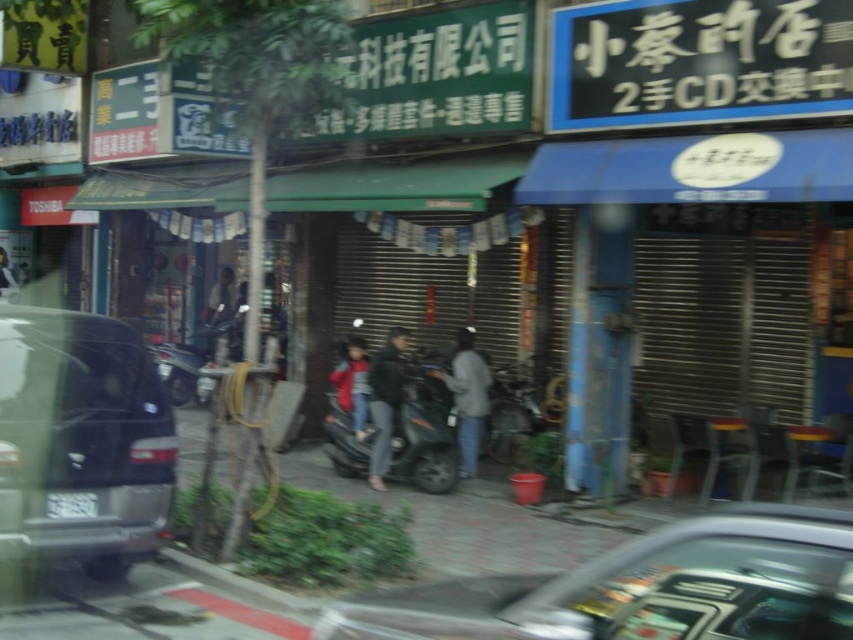
Question: Estimate the real-world distances between objects in this image. Which object is closer to the black plastic license plate at center?

Choices:
 (A) red velvet coat at center
 (B) metallic silver car at center

Answer: (B)

Question: Can you confirm if dark gray jacket at center is positioned below red velvet coat at center?

Choices:
 (A) yes
 (B) no

Answer: (A)

Question: Considering the real-world distances, which object is farthest from the black plastic license plate at center?

Choices:
 (A) metallic silver car at center
 (B) red velvet coat at center
 (C) dark gray jacket at center
 (D) matte black car at left

Answer: (B)

Question: Does gray fabric jacket at center have a larger size compared to red velvet coat at center?

Choices:
 (A) yes
 (B) no

Answer: (A)

Question: Which object is closer to the camera taking this photo?

Choices:
 (A) gray fabric jacket at center
 (B) matte black car at left
 (C) dark gray jacket at center
 (D) metallic silver car at center

Answer: (D)

Question: Can you confirm if metallic silver car at center is positioned below red velvet coat at center?

Choices:
 (A) yes
 (B) no

Answer: (A)